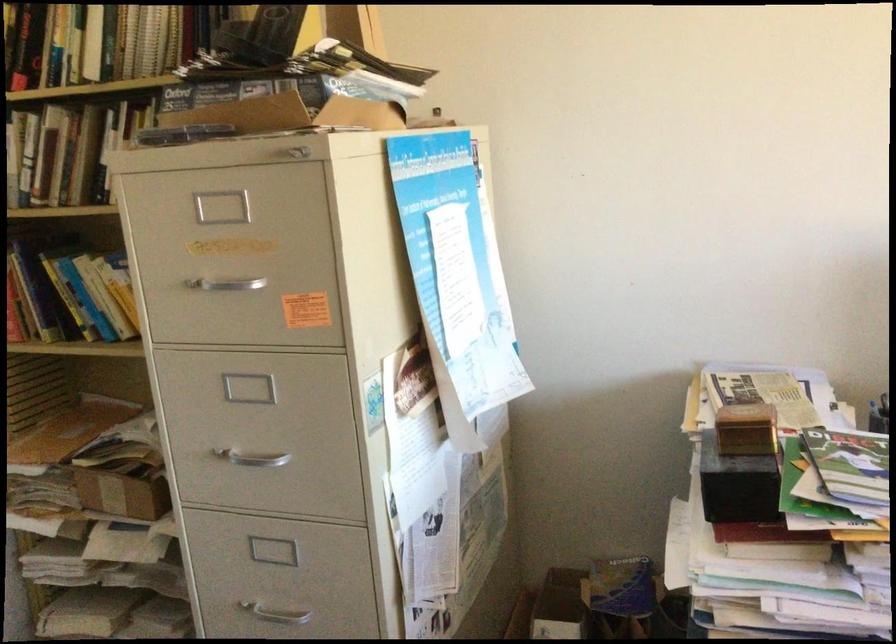
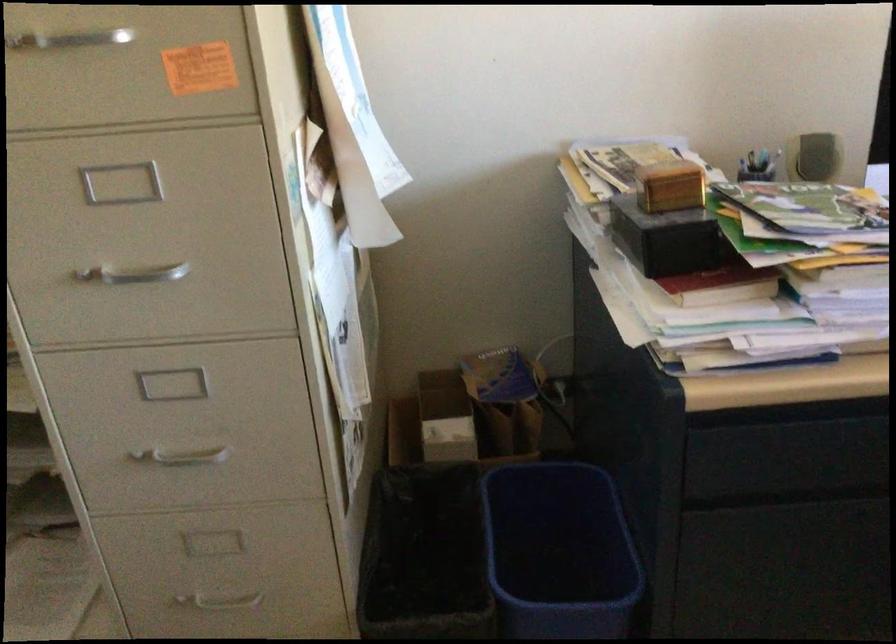
Question: Based on the continuous images, in which direction is the camera rotating? Reply with the corresponding letter.

Choices:
 (A) Left
 (B) Right
 (C) Up
 (D) Down

Answer: (B)